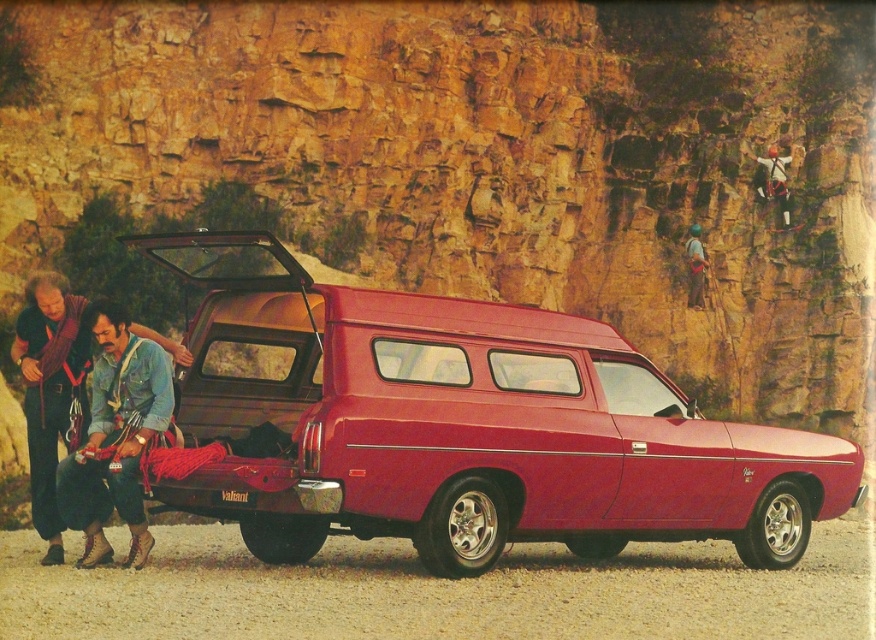
Can you confirm if glossy red van at center is positioned to the left of denim jacket at lower left?

Incorrect, glossy red van at center is not on the left side of denim jacket at lower left.

From the picture: Can you confirm if glossy red van at center is taller than denim jacket at lower left?

Yes, glossy red van at center is taller than denim jacket at lower left.

Who is more distant from viewer, (786, 451) or (132, 472)?

The point (786, 451) is behind.

Identify the location of glossy red van at center. The image size is (876, 640). click(x=461, y=426).

Does glossy red van at center lie behind rope climbing gear at upper right?

No, glossy red van at center is in front of rope climbing gear at upper right.

Between glossy red van at center and rope climbing gear at upper right, which one has more height?

With more height is glossy red van at center.

Between point (789, 538) and point (696, 305), which one is positioned in front?

Point (789, 538)

At what (x,y) coordinates should I click in order to perform the action: click on glossy red van at center. Please return your answer as a coordinate pair (x, y). Looking at the image, I should click on (461, 426).

Does denim jacket at lower left appear over rope climbing gear at upper right?

Actually, denim jacket at lower left is below rope climbing gear at upper right.

Is denim jacket at lower left wider than rope climbing gear at upper right?

Yes.

Who is more forward, [160,372] or [697,250]?

Point [160,372] is more forward.

Locate an element on the screen. This screenshot has height=640, width=876. denim jacket at lower left is located at coordinates (115, 435).